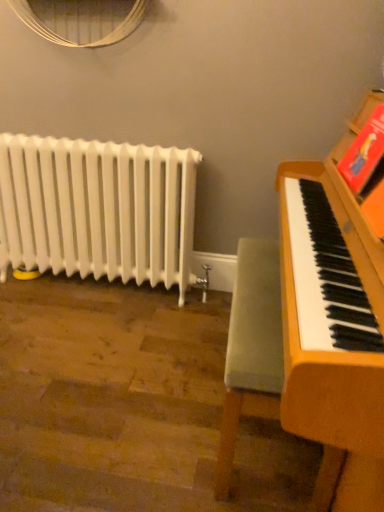
Question: Considering the relative sizes of velvet green armchair at right and white glossy radiator at left in the image provided, is velvet green armchair at right shorter than white glossy radiator at left?

Choices:
 (A) no
 (B) yes

Answer: (B)

Question: Is white glossy radiator at left located within velvet green armchair at right?

Choices:
 (A) yes
 (B) no

Answer: (B)

Question: Is velvet green armchair at right positioned behind white glossy radiator at left?

Choices:
 (A) no
 (B) yes

Answer: (A)

Question: Considering the relative sizes of velvet green armchair at right and white glossy radiator at left in the image provided, is velvet green armchair at right wider than white glossy radiator at left?

Choices:
 (A) no
 (B) yes

Answer: (B)

Question: Is velvet green armchair at right aimed at white glossy radiator at left?

Choices:
 (A) yes
 (B) no

Answer: (A)

Question: From a real-world perspective, is velvet green armchair at right on white glossy radiator at left?

Choices:
 (A) yes
 (B) no

Answer: (B)

Question: Considering the relative sizes of white glossy radiator at left and velvet green armchair at right in the image provided, is white glossy radiator at left thinner than velvet green armchair at right?

Choices:
 (A) no
 (B) yes

Answer: (B)

Question: Does white glossy radiator at left have a greater width compared to velvet green armchair at right?

Choices:
 (A) yes
 (B) no

Answer: (B)

Question: Is white glossy radiator at left outside velvet green armchair at right?

Choices:
 (A) yes
 (B) no

Answer: (A)

Question: Can you confirm if white glossy radiator at left is bigger than velvet green armchair at right?

Choices:
 (A) no
 (B) yes

Answer: (B)

Question: Is the depth of white glossy radiator at left greater than that of velvet green armchair at right?

Choices:
 (A) no
 (B) yes

Answer: (B)

Question: From a real-world perspective, is white glossy radiator at left physically above velvet green armchair at right?

Choices:
 (A) no
 (B) yes

Answer: (B)

Question: In terms of height, does velvet green armchair at right look taller or shorter compared to white glossy radiator at left?

Choices:
 (A) short
 (B) tall

Answer: (A)